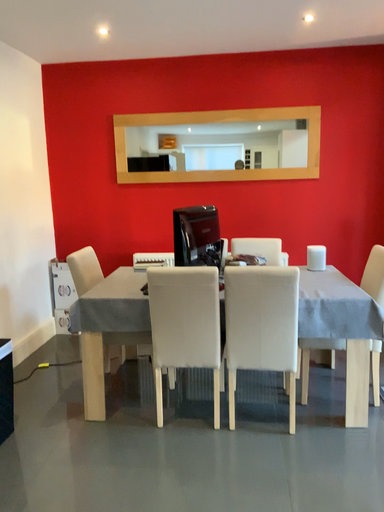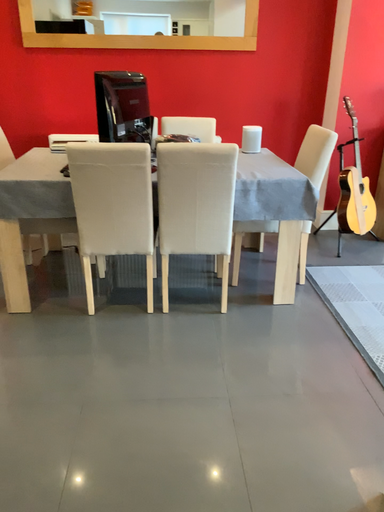
Question: How did the camera likely rotate when shooting the video?

Choices:
 (A) rotated downward
 (B) rotated upward

Answer: (A)